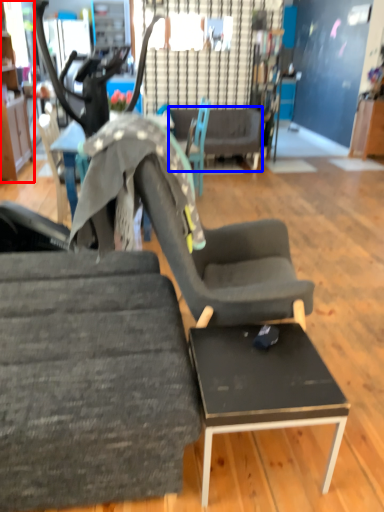
Question: Which object is closer to the camera taking this photo, cabinetry (highlighted by a red box) or couch (highlighted by a blue box)?

Choices:
 (A) cabinetry
 (B) couch

Answer: (A)